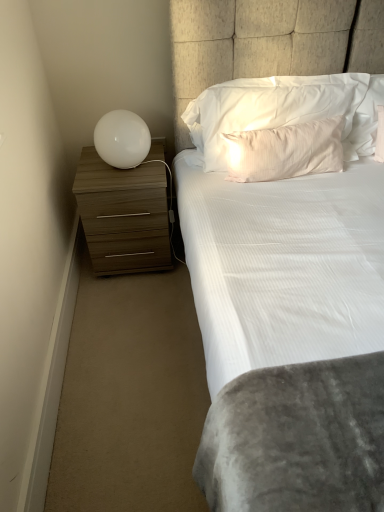
You are a GUI agent. You are given a task and a screenshot of the screen. Output one action in this format:
    pyautogui.click(x=<x>, y=<y>)
    Task: Click on the free space above wooden chest of drawers at left (from a real-world perspective)
    
    Given the screenshot: What is the action you would take?
    pyautogui.click(x=107, y=172)